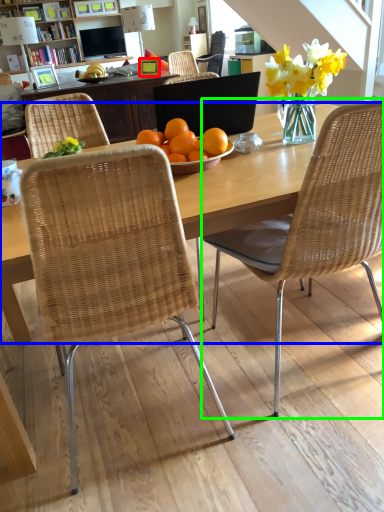
Question: Which object is positioned closest to picture frame (highlighted by a red box)? Select from desk (highlighted by a blue box) and chair (highlighted by a green box).

Choices:
 (A) desk
 (B) chair

Answer: (A)